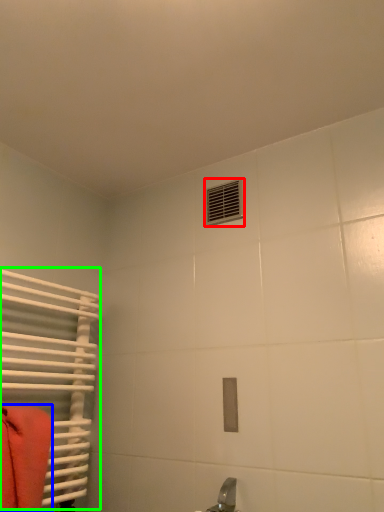
Question: Considering the real-world distances, which object is closest to air conditioning (highlighted by a red box)? towel (highlighted by a blue box) or radiator (highlighted by a green box).

Choices:
 (A) towel
 (B) radiator

Answer: (B)